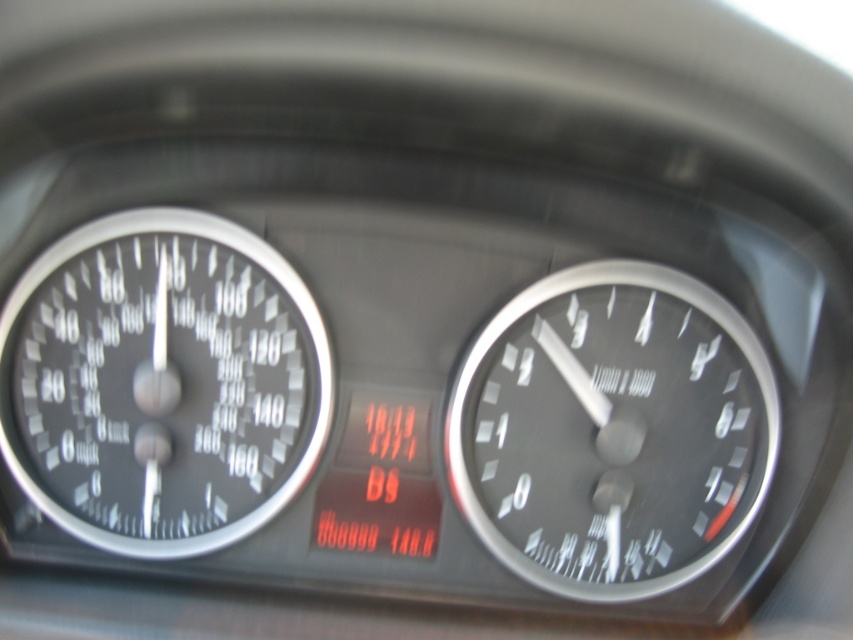
You are a mechanic checking the dashboard of a car. You notice two speedometers on the dashboard. The matte black speedometer at left and the black metallic speedometer at right. Which one has a smaller width?

The matte black speedometer at left is thinner than the black metallic speedometer at right, so the matte black speedometer at left has a smaller width.

You are a mechanic checking the dashboard of a car. You need to place a tool between the matte black speedometer at left and the black metallic speedometer at right. The tool requires 45 centimeters of space. Do you have enough space between them?

The distance between the matte black speedometer at left and the black metallic speedometer at right is 46.32 centimeters, so yes, there is enough space to place the tool between them since it requires 45 centimeters.

You are a driver checking your car dashboard. You see the matte black speedometer at left and the black metallic speedometer at right. Which gauge is positioned to the left side of the dashboard?

The matte black speedometer at left is positioned to the left of the black metallic speedometer at right, so the matte black speedometer at left is on the left side of the dashboard.